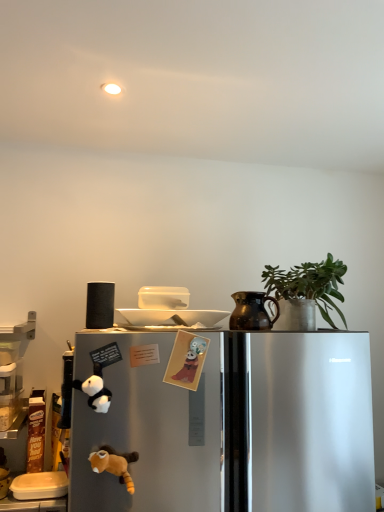
Question: Is green matte plant at upper right positioned before orange plush toy at lower left?

Choices:
 (A) no
 (B) yes

Answer: (A)

Question: Does green matte plant at upper right have a greater height compared to orange plush toy at lower left?

Choices:
 (A) no
 (B) yes

Answer: (B)

Question: Does green matte plant at upper right lie behind orange plush toy at lower left?

Choices:
 (A) yes
 (B) no

Answer: (A)

Question: Is green matte plant at upper right thinner than orange plush toy at lower left?

Choices:
 (A) no
 (B) yes

Answer: (A)

Question: Is green matte plant at upper right positioned far away from orange plush toy at lower left?

Choices:
 (A) no
 (B) yes

Answer: (A)

Question: In the image, is orange plush toy at lower left positioned in front of or behind white plastic container at lower left?

Choices:
 (A) front
 (B) behind

Answer: (A)

Question: Considering the positions of point (122, 482) and point (29, 473), is point (122, 482) closer or farther from the camera than point (29, 473)?

Choices:
 (A) closer
 (B) farther

Answer: (A)

Question: Based on their positions, is orange plush toy at lower left located to the left or right of white plastic container at lower left?

Choices:
 (A) right
 (B) left

Answer: (A)

Question: Choose the correct answer: Is orange plush toy at lower left inside white plastic container at lower left or outside it?

Choices:
 (A) outside
 (B) inside

Answer: (A)

Question: Does point (261, 293) appear closer or farther from the camera than point (246, 460)?

Choices:
 (A) farther
 (B) closer

Answer: (A)

Question: From the image's perspective, is brown matte jug at upper right positioned above or below satin silver refrigerator at center?

Choices:
 (A) below
 (B) above

Answer: (B)

Question: Is brown matte jug at upper right wider or thinner than satin silver refrigerator at center?

Choices:
 (A) thin
 (B) wide

Answer: (A)

Question: Looking at the image, does brown matte jug at upper right seem bigger or smaller compared to satin silver refrigerator at center?

Choices:
 (A) small
 (B) big

Answer: (A)

Question: Would you say satin silver refrigerator at center is inside or outside brown matte jug at upper right?

Choices:
 (A) outside
 (B) inside

Answer: (A)

Question: Considering the positions of satin silver refrigerator at center and brown matte jug at upper right in the image, is satin silver refrigerator at center bigger or smaller than brown matte jug at upper right?

Choices:
 (A) small
 (B) big

Answer: (B)